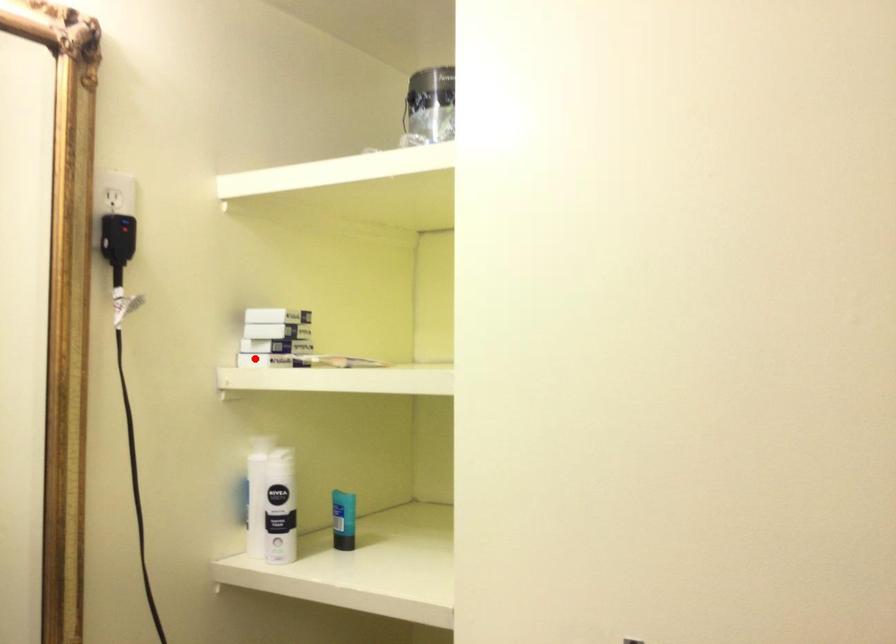
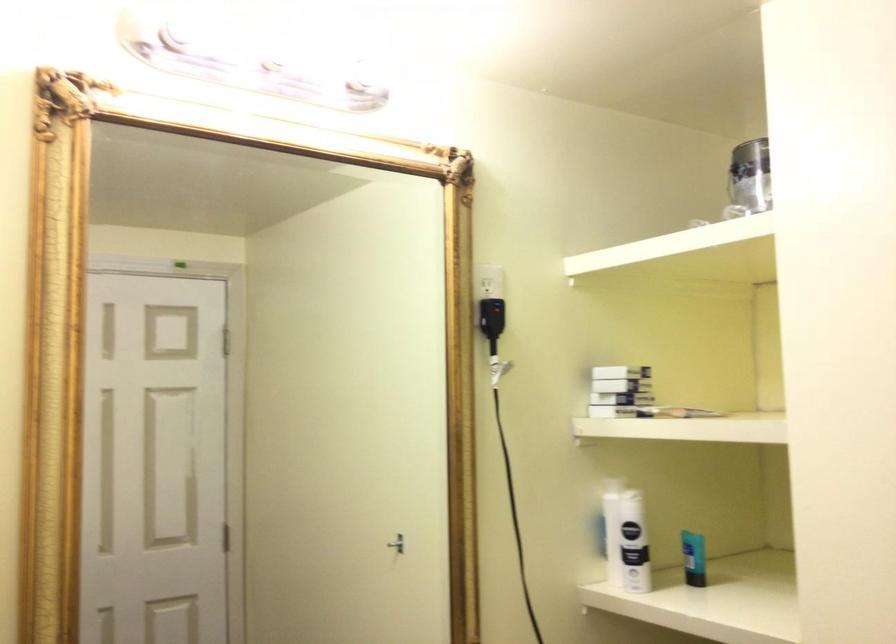
Where in the second image is the point corresponding to the highlighted location from the first image?

(614, 410)